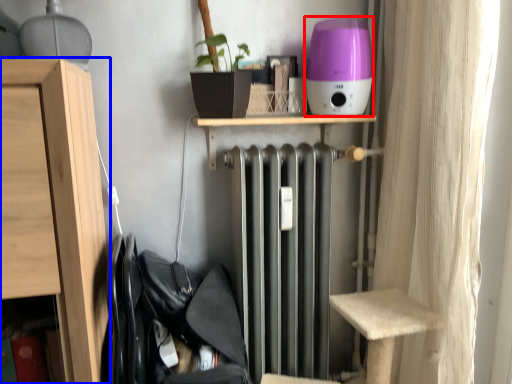
Question: Which point is closer to the camera, appliance (highlighted by a red box) or furniture (highlighted by a blue box)?

Choices:
 (A) appliance
 (B) furniture

Answer: (B)